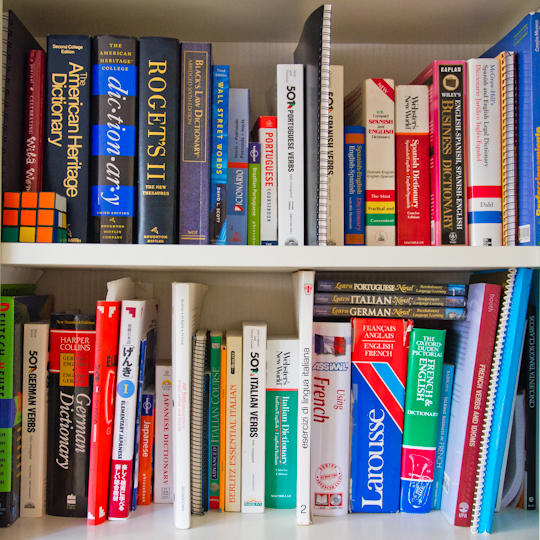
Find the location of a particular element. The image size is (540, 540). white books is located at coordinates (28, 389), (162, 432), (252, 428), (305, 479), (328, 447), (379, 153), (334, 172), (291, 165), (267, 182).